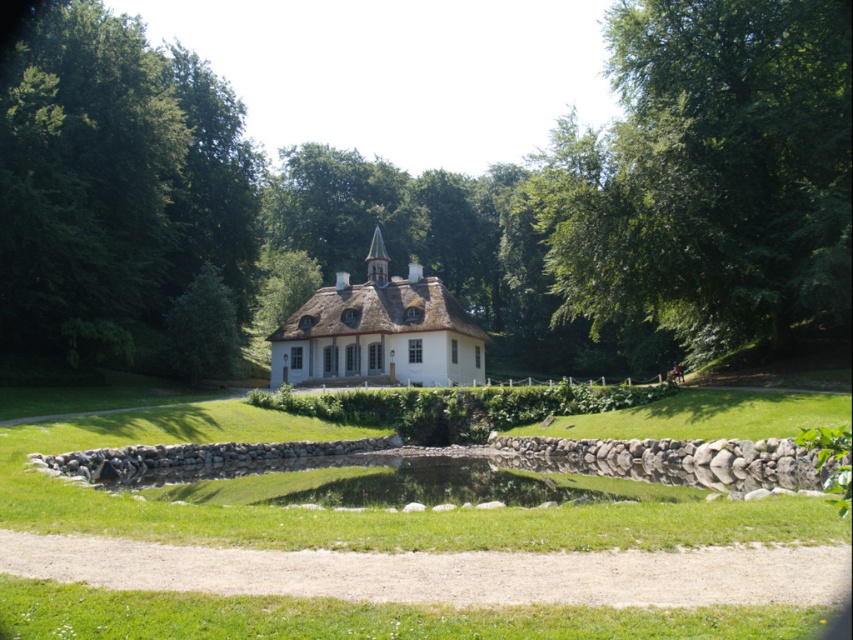
You are standing at the center of the lawn in front of the white house with a thatched roof. You see a point marked at coordinates (706,176). Which object does this point belong to?

The point at coordinates (706,176) is on the green leafy tree at upper right.

You are standing in the garden of the house and want to plant a new flower bed. The green leafy tree at upper left and the green grassy pond at center are already present. Where should you place the flower bed so it is not under the tree?

The green leafy tree at upper left is positioned over green grassy pond at center, so placing the flower bed near the pond would avoid being under the tree.